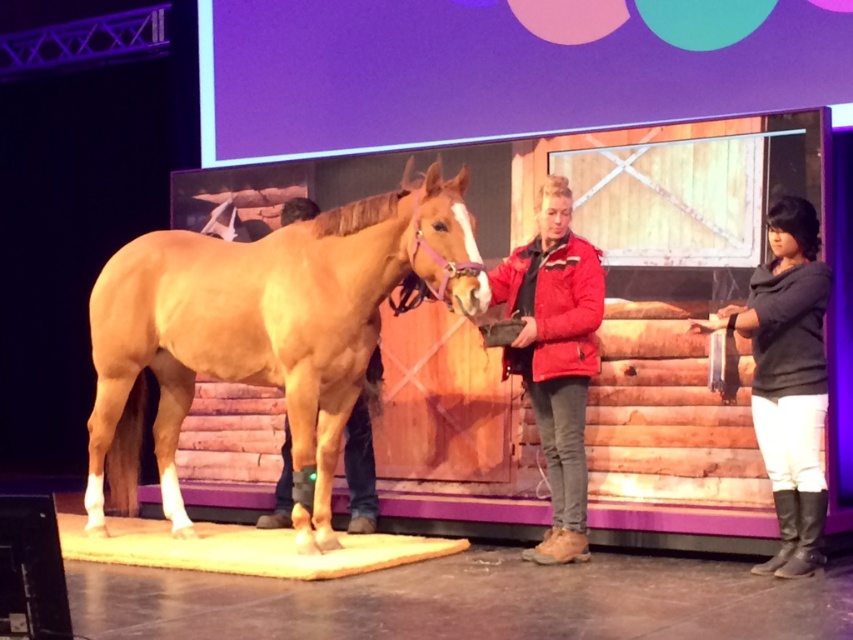
You are a photographer setting up for a photo shoot in the barn scene. You have two points marked on your camera screen at coordinates point (x=108, y=304) and point (x=576, y=381). Which point is closer to your camera lens?

Point (x=108, y=304) is further to the camera than point (x=576, y=381). Therefore, point (x=576, y=381) is closer to the camera lens.

You are an actor in a play and need to choose a costume that is shorter in height. You see a dark gray sweater at right and a red jacket at center. Which one should you pick?

The dark gray sweater at right has a lesser height compared to the red jacket at center, so you should pick the dark gray sweater at right.